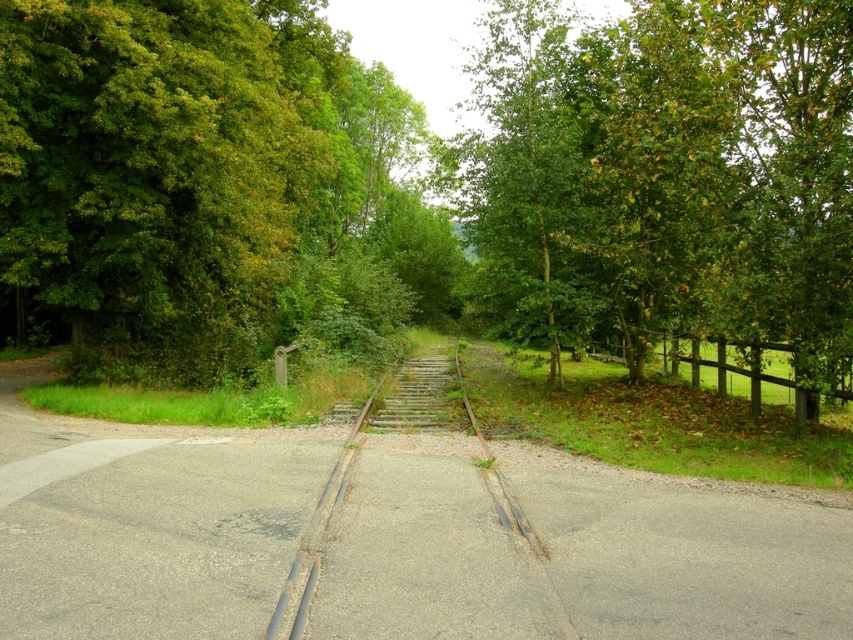
Between green leafy tree at center and rusty metal train track at center, which one is positioned higher?

green leafy tree at center is above.

I want to click on green leafy tree at center, so (209, 188).

Identify the location of green leafy tree at center. The height and width of the screenshot is (640, 853). (209, 188).

Is green leafy tree at center above brown wooden fence at right?

Yes.

Who is more distant from viewer, (33,284) or (717,380)?

The point (717,380) is more distant.

The width and height of the screenshot is (853, 640). In order to click on green leafy tree at center in this screenshot , I will do `click(209, 188)`.

Which of these two, green leafy tree at center or green leafy tree at upper right, stands shorter?

green leafy tree at center is shorter.

How far apart are green leafy tree at center and green leafy tree at upper right?

green leafy tree at center is 8.52 meters away from green leafy tree at upper right.

The width and height of the screenshot is (853, 640). Describe the element at coordinates (209, 188) in the screenshot. I see `green leafy tree at center` at that location.

Where is `green leafy tree at center`? The width and height of the screenshot is (853, 640). green leafy tree at center is located at coordinates (209, 188).